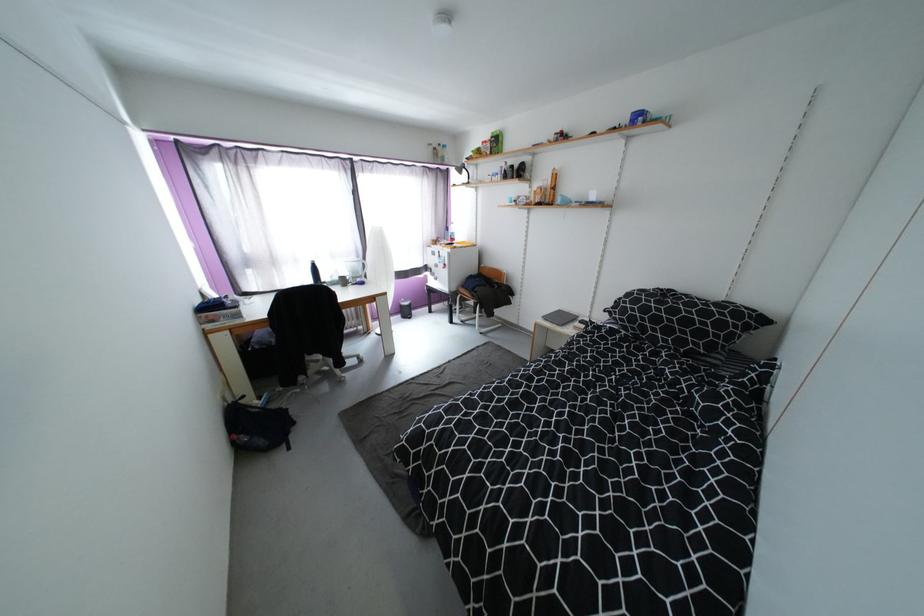
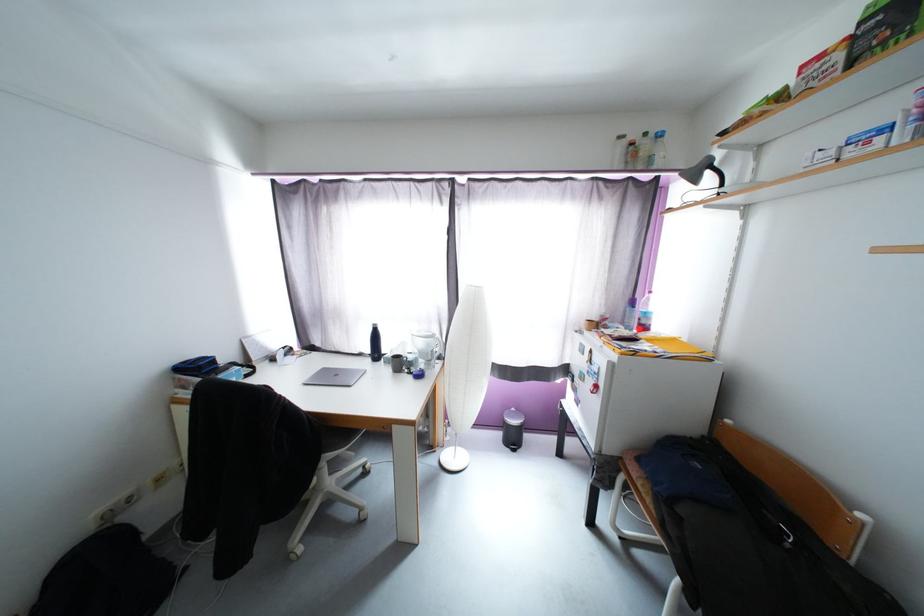
Where in the second image is the point corresponding to pixel 441 150 from the first image?

(638, 146)